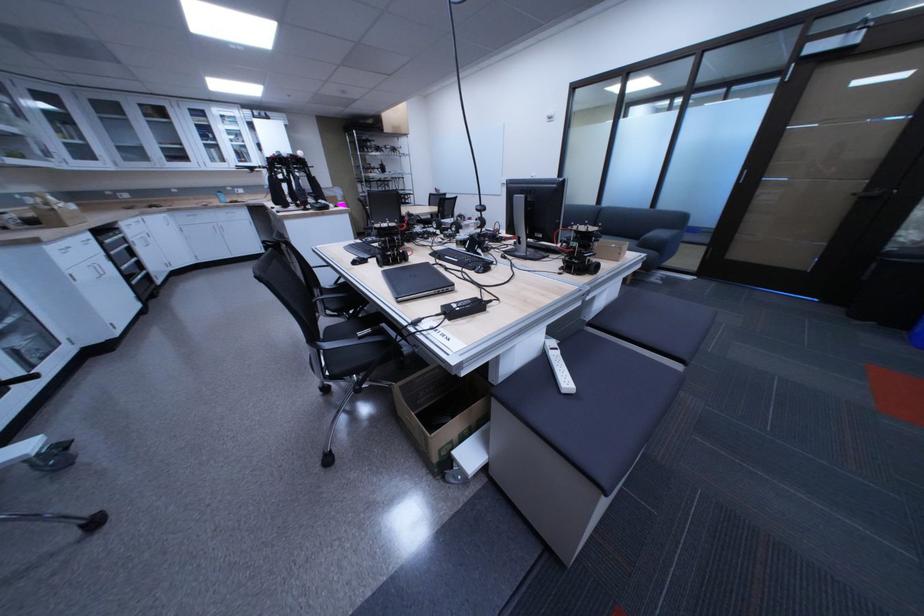
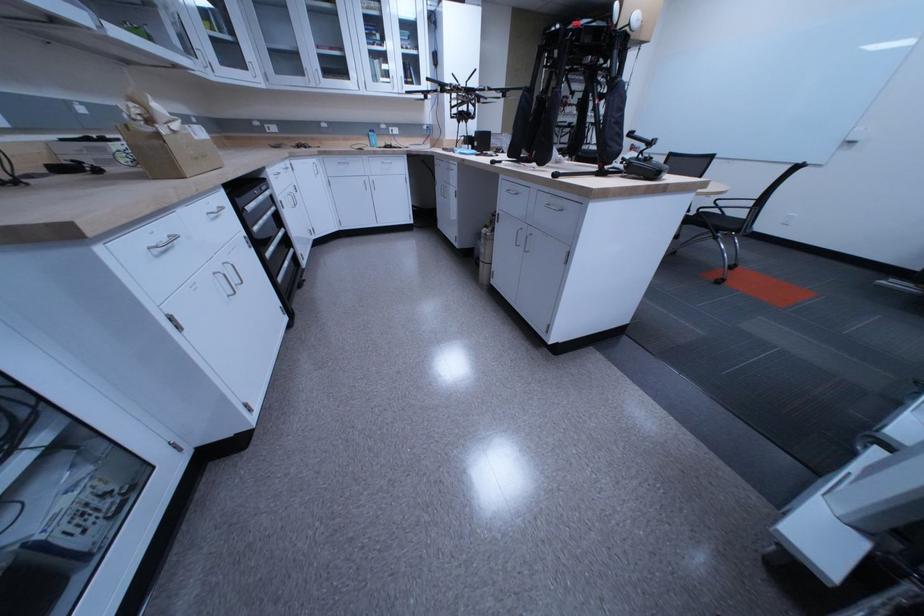
The point at [68,211] is marked in the first image. Where is the corresponding point in the second image?

(174, 137)